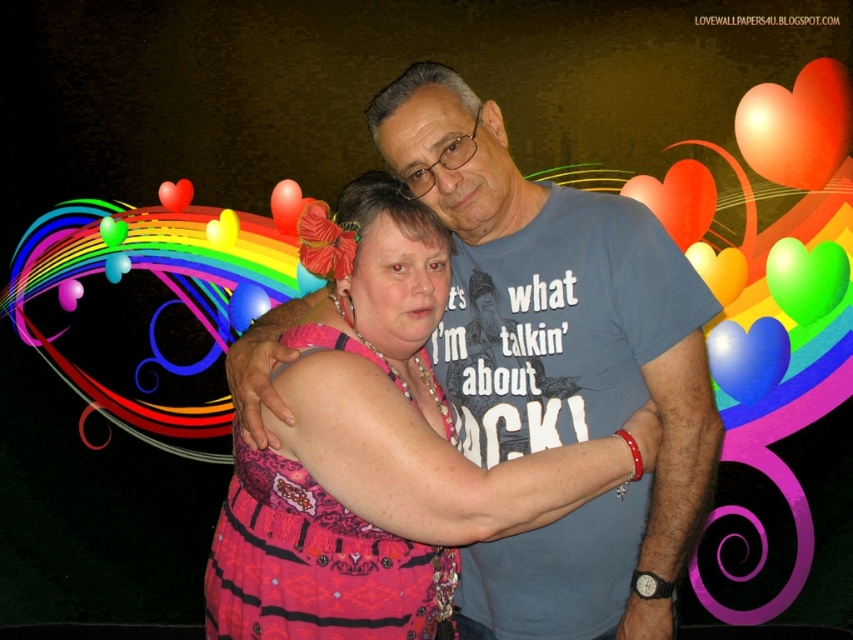
You are planning to hang a small decoration between the pink rubber balloon at center and the translucent pink balloon at upper left. The decoration requires 5 inches of space. Do you think there is enough space between them?

The pink rubber balloon at center and the translucent pink balloon at upper left are 6.00 inches apart from each other, so yes, there is enough space to hang the decoration between them since 6 inches is more than the required 5 inches.

You are planning to hang a 10 inch wide painting between the rubber heart at upper left and the green glossy balloon at upper right. Based on the scene, will the painting fit between them without overlapping?

The distance between the rubber heart at upper left and the green glossy balloon at upper right is 8.33 inches, which is less than the painting width of 10 inches. Therefore, the painting will not fit between them without overlapping.

You are standing in front of the image and want to place a pink rubber balloon at center. Is the point at coordinates (68, 292) the correct location for the balloon?

Yes, the pink rubber balloon at center is represented by point (68, 292), so the coordinates are correct.